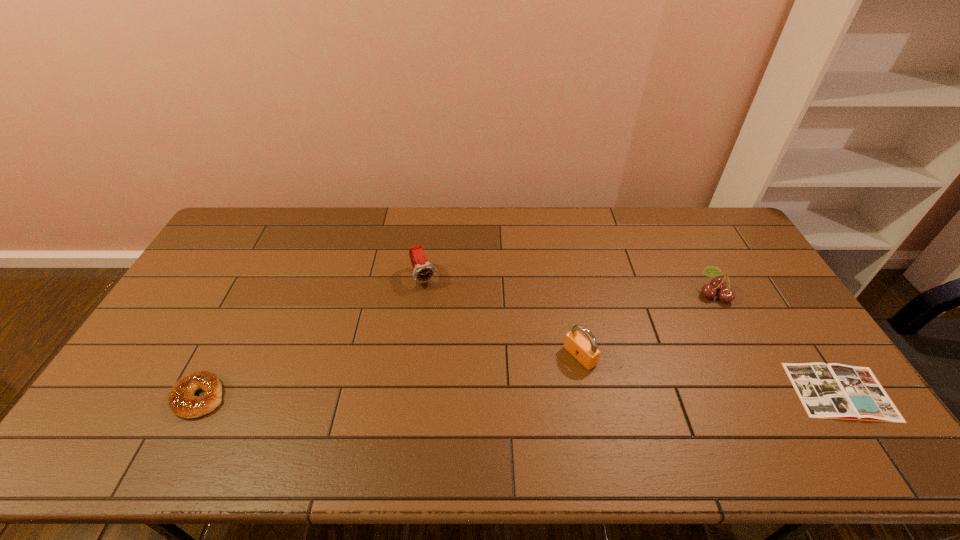
Identify the location of vacant space on the desktop that is between the fourth tallest object and the book and is positioned to unlock the third object from left to right from the front. (522, 394).

I want to click on free spot on the desktop that is between the fourth tallest object and the book and is positioned on the face of the fourth object from right to left, so click(483, 394).

Where is `free space on the desktop that is between the leftmost object and the shortest object and is positioned on the leaves of the second object from right to left`? free space on the desktop that is between the leftmost object and the shortest object and is positioned on the leaves of the second object from right to left is located at coordinates (597, 394).